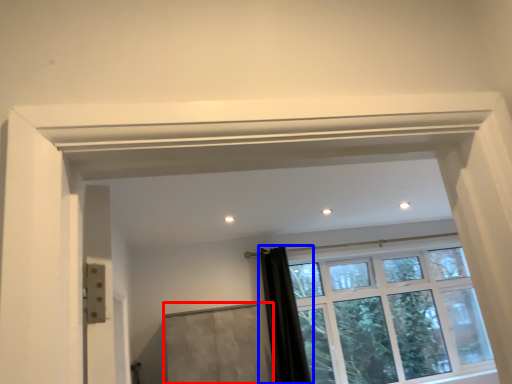
Question: Which object appears farthest to the camera in this image, screen door (highlighted by a red box) or shower curtain (highlighted by a blue box)?

Choices:
 (A) screen door
 (B) shower curtain

Answer: (B)